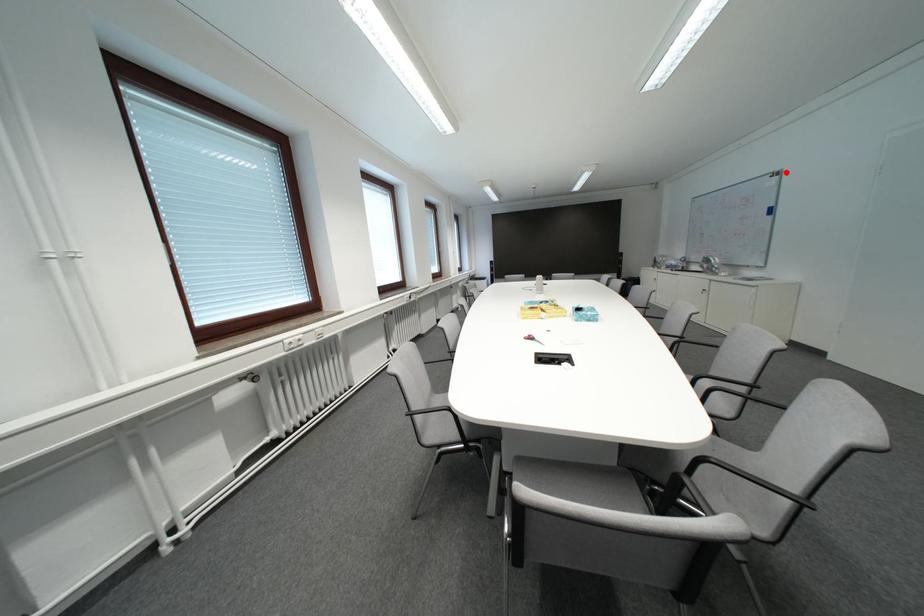
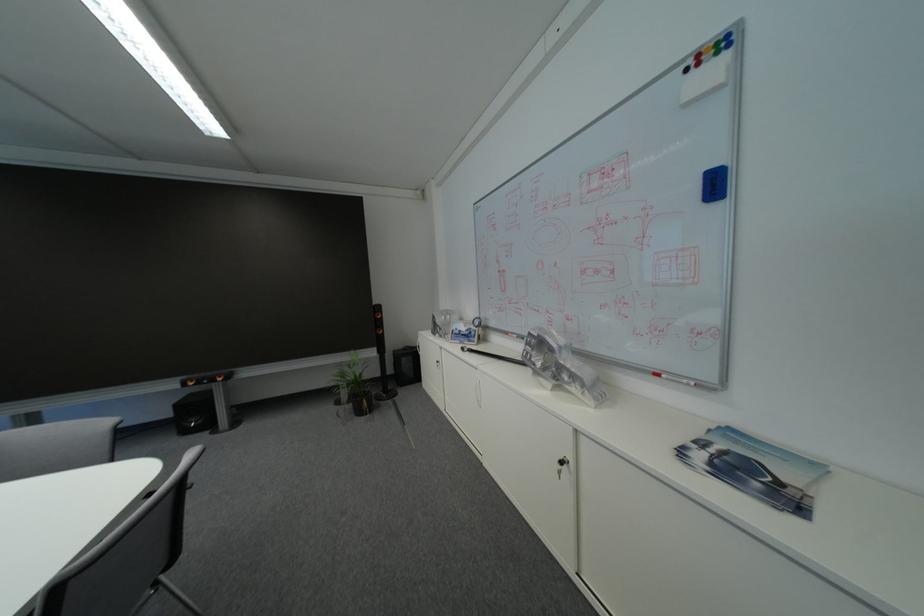
Where in the second image is the point corresponding to the highlighted location from the first image?

(723, 34)